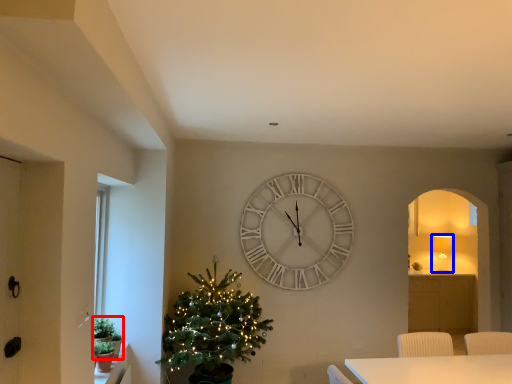
Question: Which point is closer to the camera, plant (highlighted by a red box) or lamp (highlighted by a blue box)?

Choices:
 (A) plant
 (B) lamp

Answer: (A)